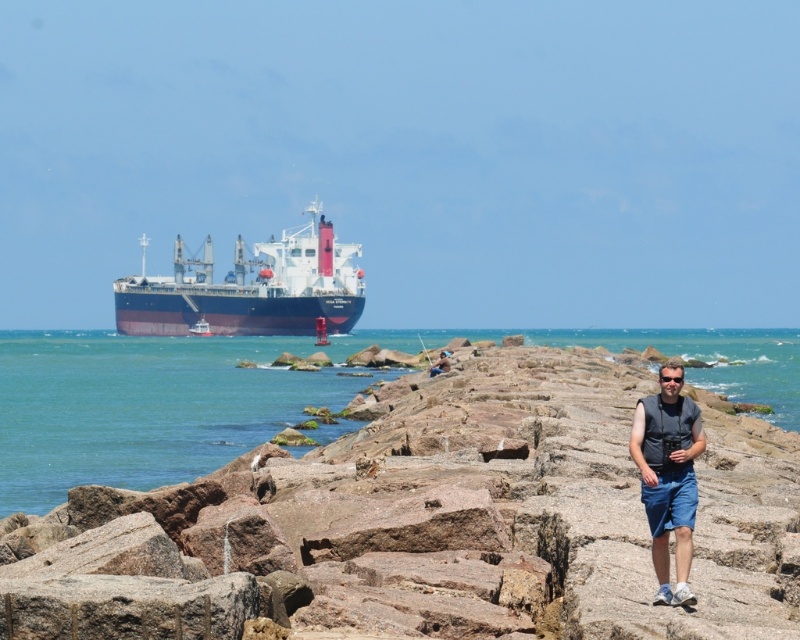
You are standing at the point with coordinates point (668, 438) and want to walk towards the point with coordinates point (138, 330). Is the point you want to reach located behind you or in front of you?

The point (138, 330) is behind point (668, 438), so the point you want to reach is behind you.

You are a photographer on the jetty and want to capture both the dark blue matte cargo ship at center and the dark gray vest at center in your frame. Which object should you focus on first to ensure both are in the shot?

The dark blue matte cargo ship at center is larger in size than the dark gray vest at center, so you should focus on the larger cargo ship first to ensure both fit within the frame.